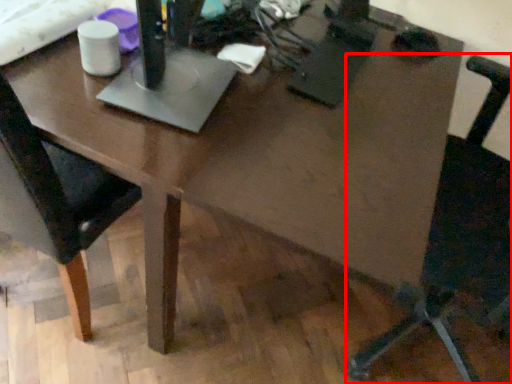
Question: From the image's perspective, what is the correct spatial positioning of chair (annotated by the red box) in reference to chair?

Choices:
 (A) above
 (B) below

Answer: (B)